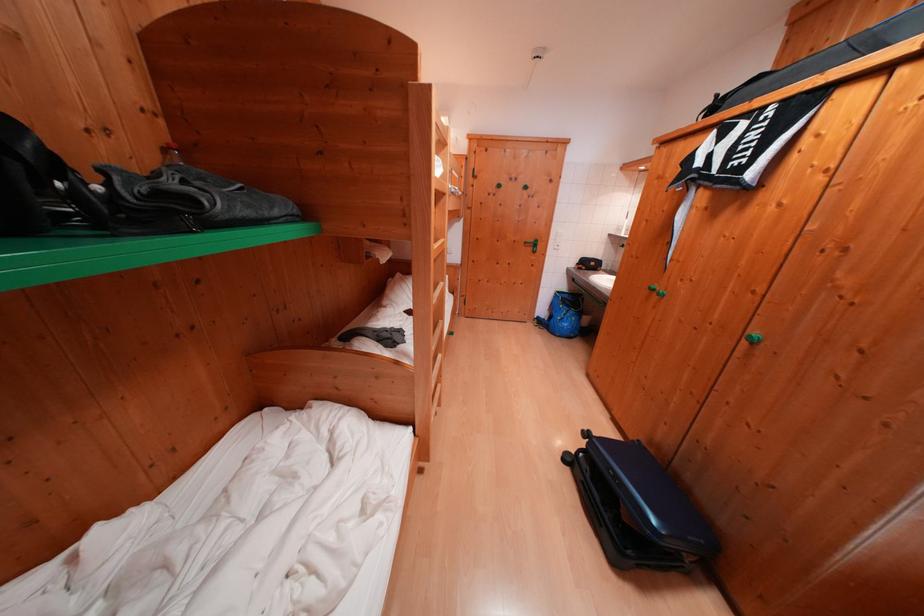
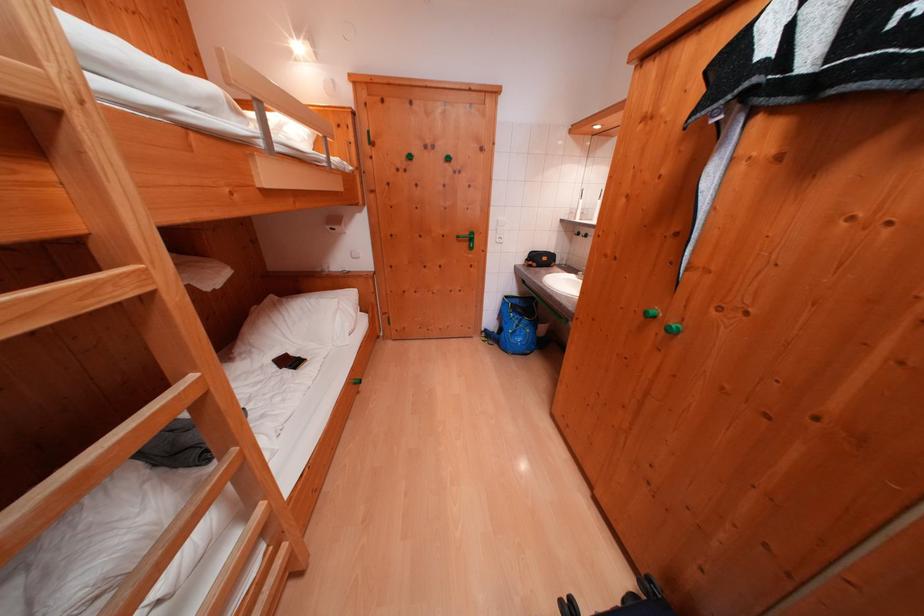
Find the pixel in the second image that matches (x=533, y=246) in the first image.

(466, 241)